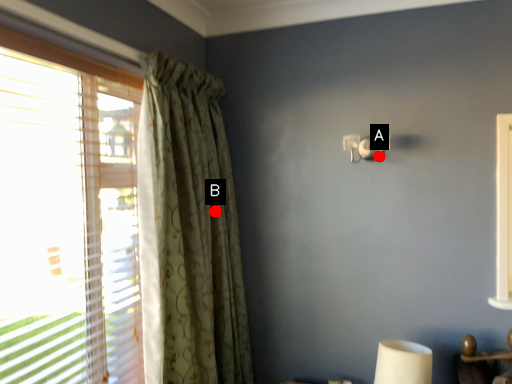
Question: Two points are circled on the image, labeled by A and B beside each circle. Among these points, which one is farthest from the camera?

Choices:
 (A) A is further
 (B) B is further

Answer: (B)